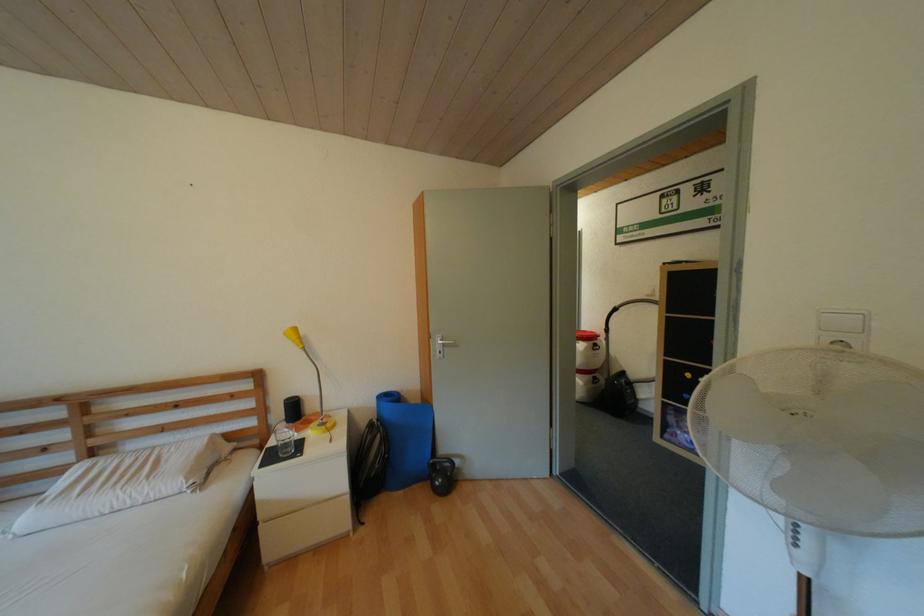
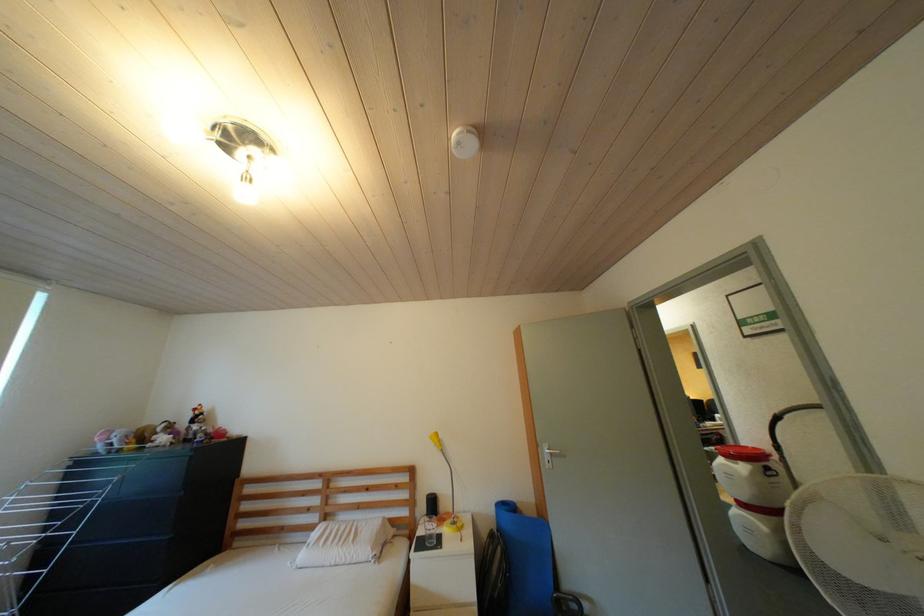
Where in the second image is the point corresponding to (277,428) from the first image?

(424, 520)